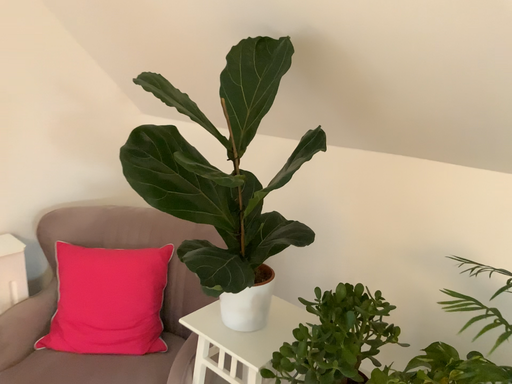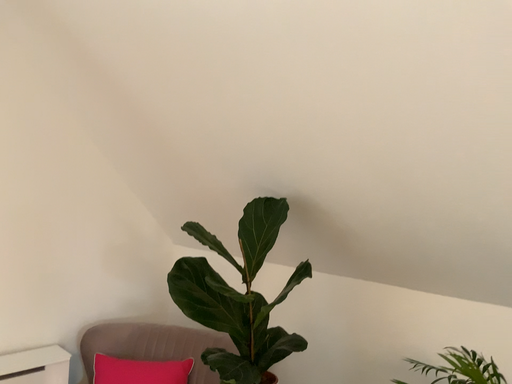
Question: How did the camera likely rotate when shooting the video?

Choices:
 (A) rotated downward
 (B) rotated upward

Answer: (B)